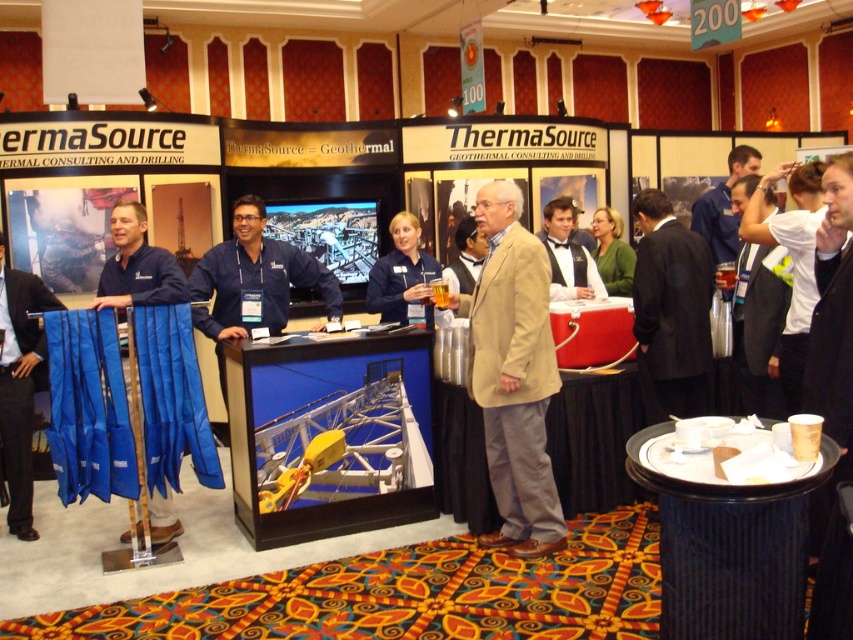
Question: Which object is positioned closest to the light brown suit at center?

Choices:
 (A) blue uniform at center
 (B) blue fabric at center

Answer: (A)

Question: Is blue fabric at left closer to the viewer compared to blue fabric at center?

Choices:
 (A) yes
 (B) no

Answer: (B)

Question: Does tan fabric coat at center have a lesser width compared to blue uniform at center?

Choices:
 (A) no
 (B) yes

Answer: (B)

Question: Which point is farther to the camera?

Choices:
 (A) (402, 282)
 (B) (125, 216)

Answer: (A)

Question: Which point is closer to the camera?

Choices:
 (A) (106, 260)
 (B) (563, 236)

Answer: (A)

Question: Can you confirm if tan fabric coat at center is positioned to the right of blue fabric at left?

Choices:
 (A) no
 (B) yes

Answer: (B)